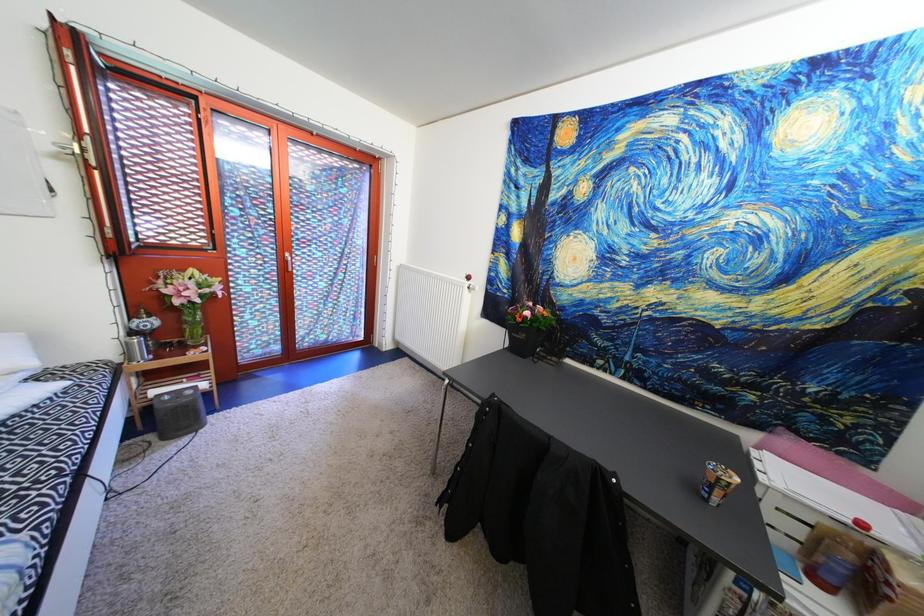
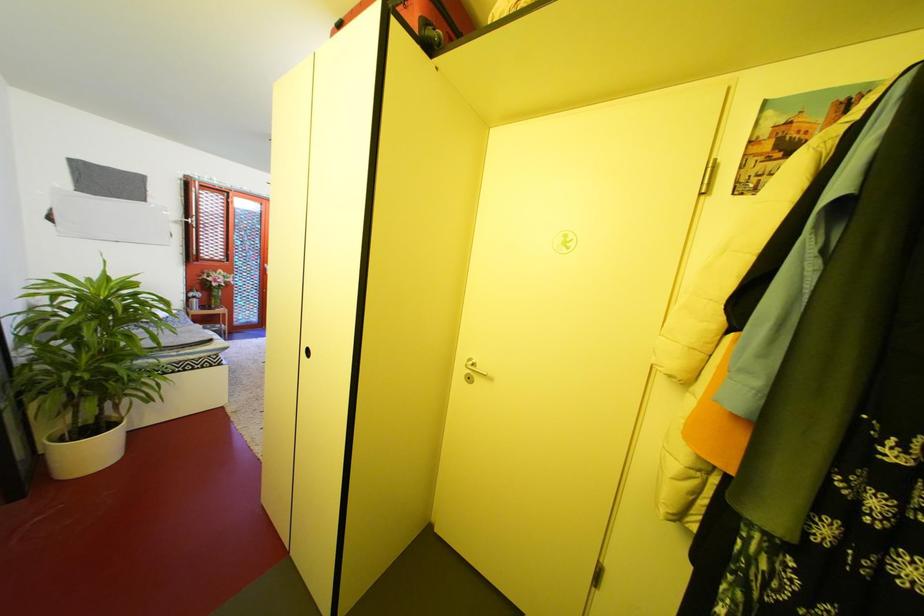
What movement of the cameraman would produce the second image?

The cameraman walked toward right, backward.